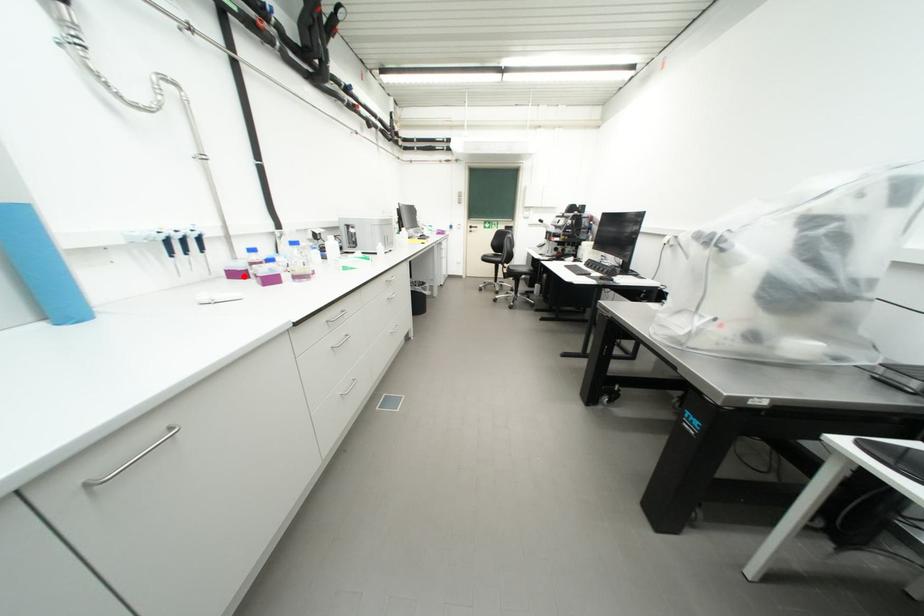
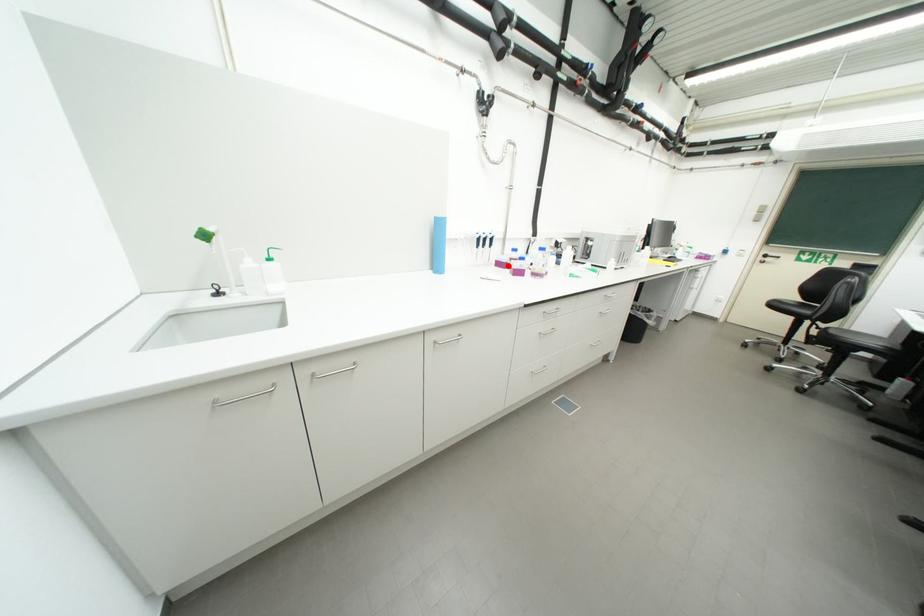
I am providing you with two images of the same scene from different viewpoints. A red point is marked on the first image and another point is marked on the second image. Does the point marked in image1 correspond to the same location as the one in image2?

Yes